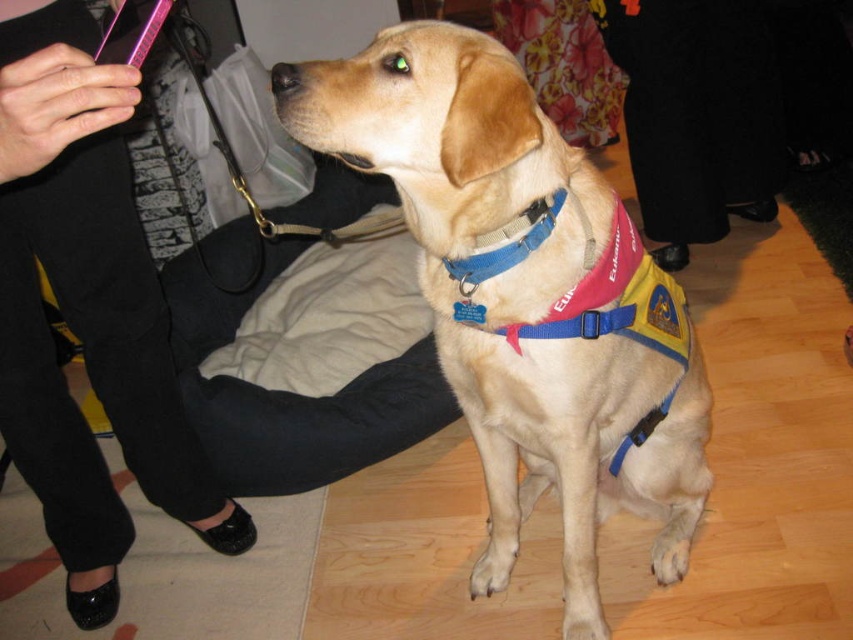
Question: Is golden fur vest at center positioned in front of black fabric pants at lower left?

Choices:
 (A) no
 (B) yes

Answer: (B)

Question: Estimate the real-world distances between objects in this image. Which object is closer to the black fabric pants at lower center?

Choices:
 (A) black fabric pants at lower left
 (B) golden fur vest at center

Answer: (B)

Question: Does golden fur vest at center appear over black fabric pants at lower center?

Choices:
 (A) no
 (B) yes

Answer: (A)

Question: Which point is farther from the camera taking this photo?

Choices:
 (A) (671, 54)
 (B) (518, 77)
 (C) (62, 515)

Answer: (A)

Question: Which object is closer to the camera taking this photo?

Choices:
 (A) black fabric pants at lower center
 (B) golden fur vest at center

Answer: (B)

Question: Can you confirm if golden fur vest at center is positioned to the right of black fabric pants at lower left?

Choices:
 (A) yes
 (B) no

Answer: (A)